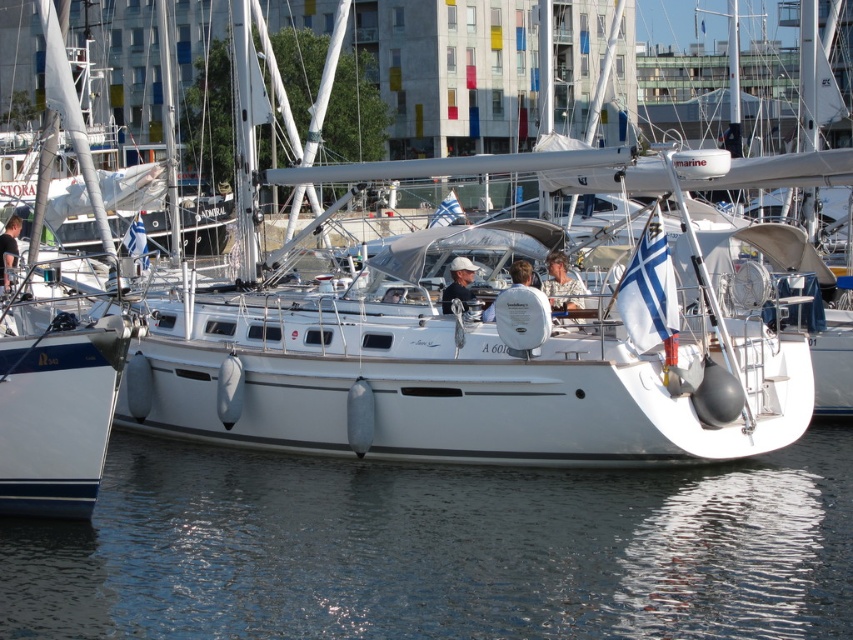
You are standing at the pier and want to reach a specific point in the marina. The point is located at coordinates point (552, 513). If your maximum comfortable walking distance is 70 feet, can you comfortably reach this point from where you are standing?

The distance of point (552, 513) from camera is 72.70 feet, which exceeds your maximum comfortable walking distance of 70 feet. Therefore, you cannot comfortably reach this point.

You are standing on the pier and looking at the transparent water at lower center and the white matte sailboat at center. Which object appears taller from your viewpoint?

The white matte sailboat at center appears taller than the transparent water at lower center because the sailboat has a greater height according to the description.

You are standing on the pier and want to know the exact location of the transparent water at lower center in the image. Can you tell me its coordinates?

The transparent water at lower center is located at coordinates point (438, 548).